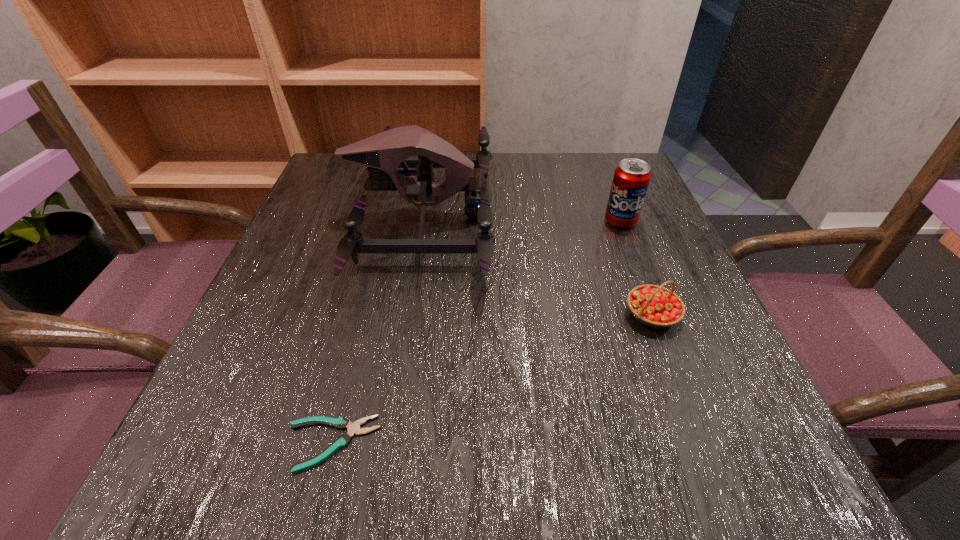
Image resolution: width=960 pixels, height=540 pixels. What are the coordinates of `vacant point at the right edge` in the screenshot? It's located at (619, 296).

This screenshot has height=540, width=960. What are the coordinates of `free space at the far left corner` in the screenshot? It's located at (316, 189).

In the image, there is a desktop. Identify the location of free space at the far right corner. (645, 199).

Identify the location of vacant area between the drone and the pliers. (376, 331).

Identify the location of vacant area between the shortest object and the drone. Image resolution: width=960 pixels, height=540 pixels. (376, 331).

The image size is (960, 540). What are the coordinates of `vacant space that is in between the second tallest object and the tallest object` in the screenshot? It's located at (521, 219).

Identify the location of free space between the drone and the second tallest object. The image size is (960, 540). (521, 219).

I want to click on free point between the soda can and the drone, so click(x=521, y=219).

Identify the location of vacant space in between the soda can and the tallest object. This screenshot has width=960, height=540. (521, 219).

At what (x,y) coordinates should I click in order to perform the action: click on free space between the second tallest object and the tallest object. Please return your answer as a coordinate pair (x, y). Looking at the image, I should click on (521, 219).